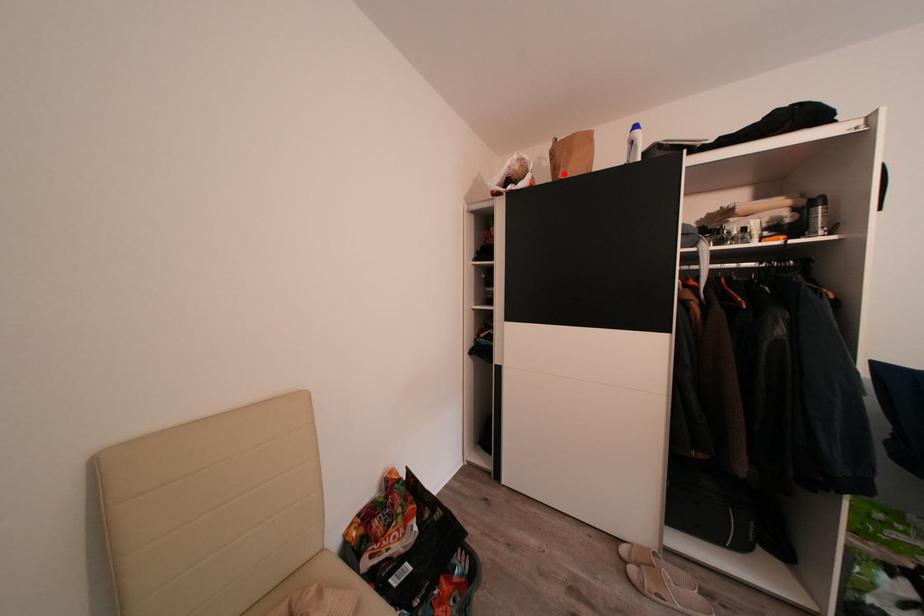
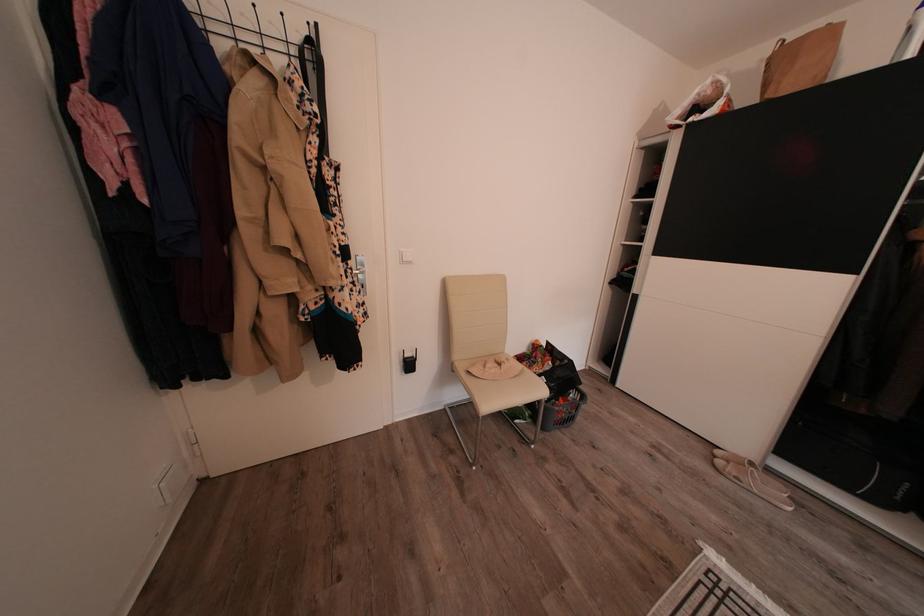
Locate, in the second image, the point that corresponds to the highlighted location in the first image.

(773, 91)